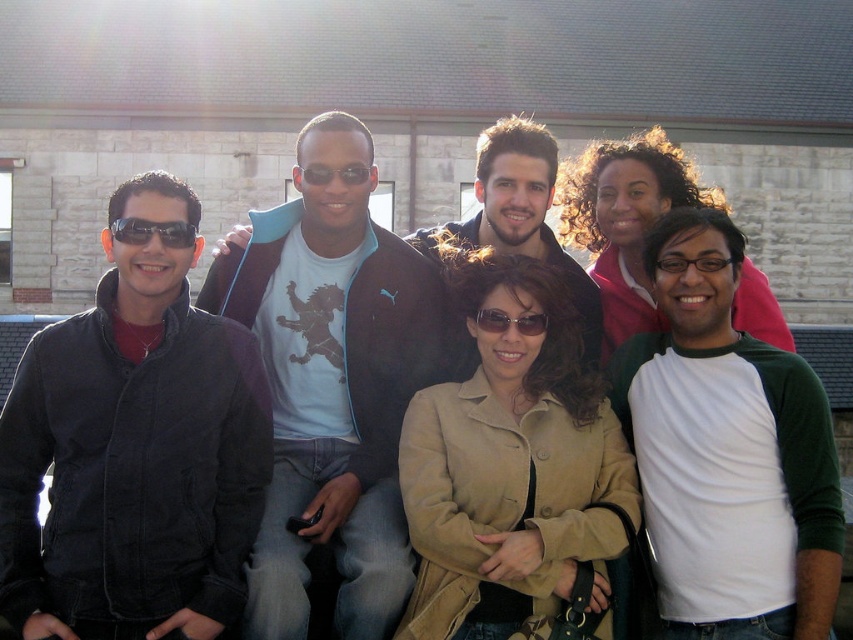
Between point (387, 240) and point (428, 522), which one is positioned behind?

Positioned behind is point (387, 240).

From the picture: Is light blue t-shirt with lion graphic at center positioned in front of tan suede jacket at center?

Yes, it is in front of tan suede jacket at center.

Describe the element at coordinates (332, 385) in the screenshot. I see `light blue t-shirt with lion graphic at center` at that location.

You are a GUI agent. You are given a task and a screenshot of the screen. Output one action in this format:
    pyautogui.click(x=<x>, y=<y>)
    Task: Click on the light blue t-shirt with lion graphic at center
    The width and height of the screenshot is (853, 640).
    Given the screenshot: What is the action you would take?
    pyautogui.click(x=332, y=385)

Can you confirm if light blue t-shirt with lion graphic at center is taller than matte black sunglasses at center?

Correct, light blue t-shirt with lion graphic at center is much taller as matte black sunglasses at center.

Between light blue t-shirt with lion graphic at center and matte black sunglasses at center, which one appears on the left side from the viewer's perspective?

Positioned to the left is light blue t-shirt with lion graphic at center.

Is point (438, 276) positioned behind point (349, 177)?

Yes, it is.

Identify the location of light blue t-shirt with lion graphic at center. The image size is (853, 640). (332, 385).

Is matte black jacket at left below tan suede jacket at center?

Yes.

Which is below, matte black jacket at left or tan suede jacket at center?

matte black jacket at left is lower down.

The height and width of the screenshot is (640, 853). Describe the element at coordinates (134, 451) in the screenshot. I see `matte black jacket at left` at that location.

At what (x,y) coordinates should I click in order to perform the action: click on matte black jacket at left. Please return your answer as a coordinate pair (x, y). This screenshot has width=853, height=640. Looking at the image, I should click on (134, 451).